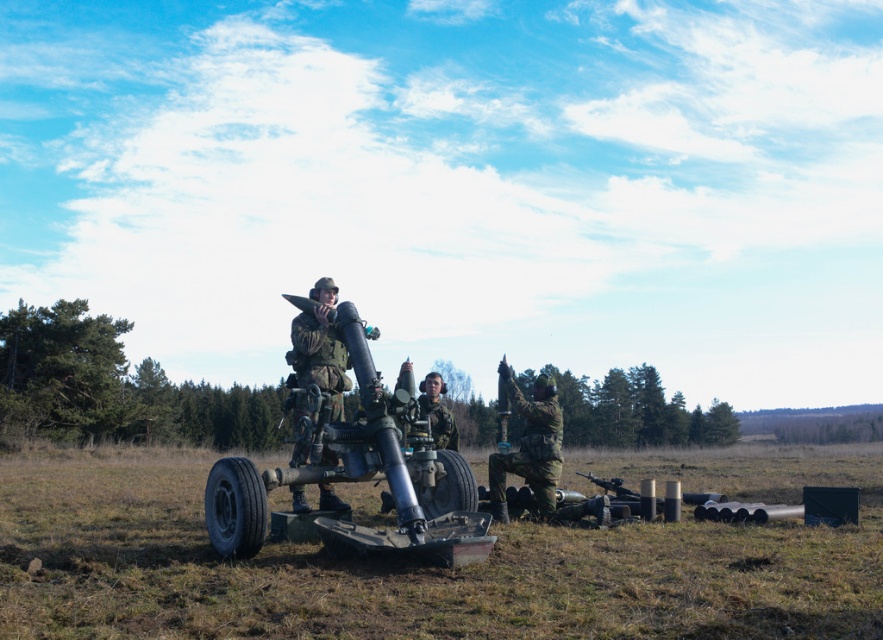
You are a military engineer tasked with retrieving the matte black rifle at center from the camouflage fabric uniform at center. The minimum safe distance for handling explosives is 5 meters. Can you safely retrieve the rifle without violating safety protocols?

The camouflage fabric uniform at center is 4.99 meters away from matte black rifle at center. Since the distance is less than the required 5 meters, retrieving the rifle would violate the safety protocols. You need to maintain a distance of at least 5 meters to handle explosives safely.